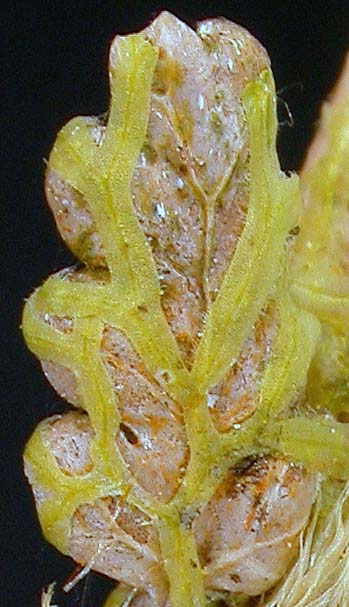
Locate an element on the screen. The image size is (349, 607). light reflections is located at coordinates (201, 100), (147, 447), (163, 206), (212, 398).